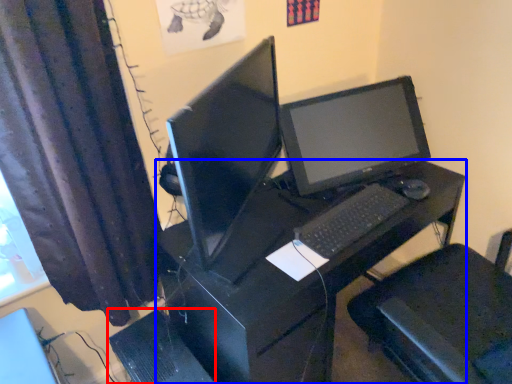
Question: Among these objects, which one is farthest to the camera, computer tower (highlighted by a red box) or desk (highlighted by a blue box)?

Choices:
 (A) computer tower
 (B) desk

Answer: (A)